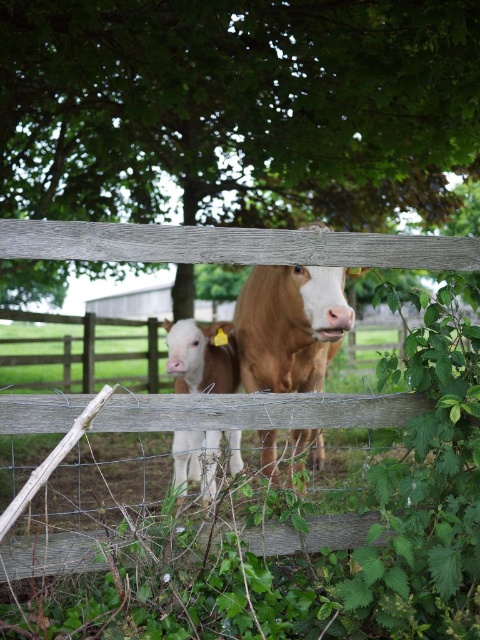
Question: Is brown matte cow at center below white smooth calf at center?

Choices:
 (A) no
 (B) yes

Answer: (A)

Question: Does green leafy tree at upper center appear on the left side of white smooth calf at center?

Choices:
 (A) yes
 (B) no

Answer: (B)

Question: Which point is farther to the camera?

Choices:
 (A) pos(252,362)
 (B) pos(421,205)

Answer: (B)

Question: Which object is positioned farthest from the white smooth calf at center?

Choices:
 (A) brown matte cow at center
 (B) green leafy tree at upper center

Answer: (B)

Question: Is green leafy tree at upper center above white smooth calf at center?

Choices:
 (A) yes
 (B) no

Answer: (A)

Question: Estimate the real-world distances between objects in this image. Which object is farther from the brown matte cow at center?

Choices:
 (A) green leafy tree at upper center
 (B) white smooth calf at center

Answer: (A)